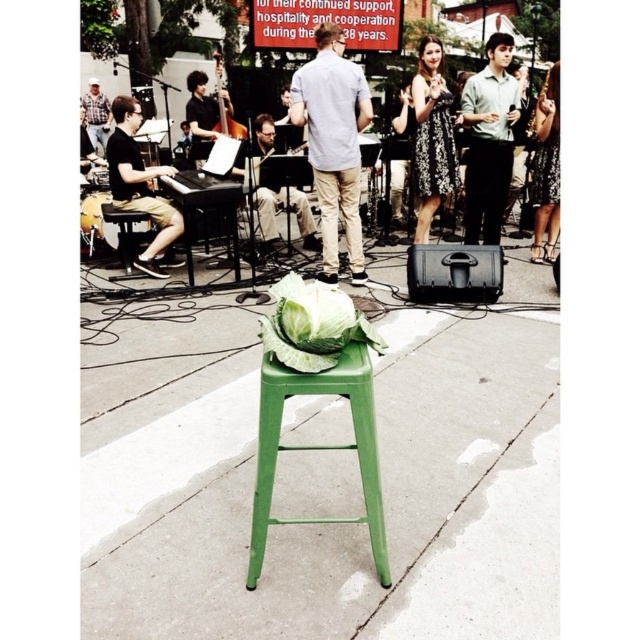
You are a photographer setting up for a street performance. You have a green metal bar stool at center and a matte black shirt at center in your frame. Which object should you adjust your camera focus on if you want to capture the smaller object?

The green metal bar stool at center is smaller than the matte black shirt at center, so you should focus on the green metal bar stool at center to capture the smaller object.

You are standing at the center of the image. Looking around, you see a green metal stool and a green leafy vegetable at center. Which object is exactly at the coordinates point [314,324]?

The point [314,324] corresponds to the green leafy vegetable at center.

You are an observer at the lively outdoor event. You notice two people wearing the light blue shirt at center and the satin gold dress at upper right. Which one is positioned higher in the image?

The satin gold dress at upper right is positioned higher than the light blue shirt at center, as the light blue shirt at center is below the satin gold dress at upper right.